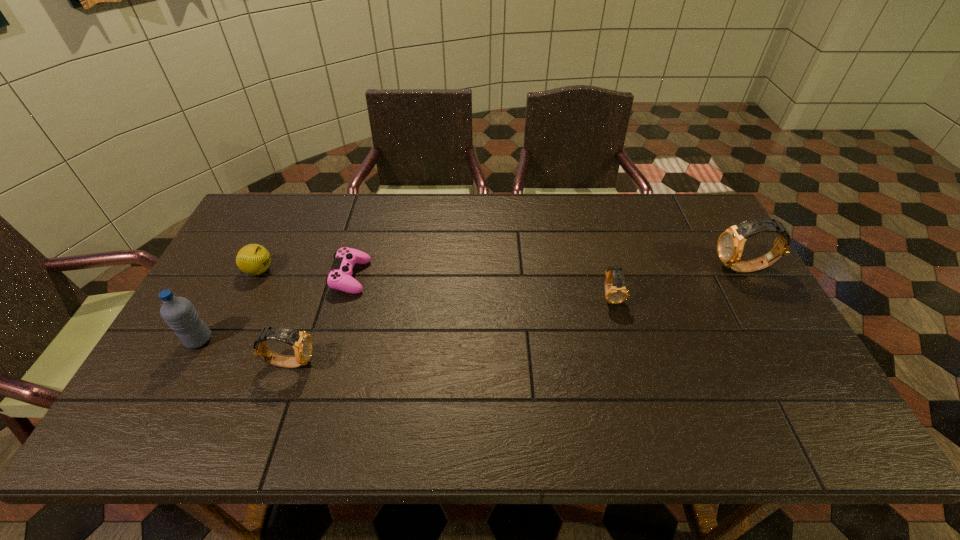
The width and height of the screenshot is (960, 540). Identify the location of object that is at the right edge. (730, 245).

Identify the location of free region at the far edge. (562, 200).

Where is `vacant space at the near edge of the desktop`? vacant space at the near edge of the desktop is located at coordinates (399, 381).

In the image, there is a desktop. Identify the location of vacant region at the left edge. (240, 297).

This screenshot has height=540, width=960. In the image, there is a desktop. Find the location of `vacant space at the right edge`. vacant space at the right edge is located at coordinates (709, 283).

Locate an element on the screen. The image size is (960, 540). free spot at the far left corner of the desktop is located at coordinates (270, 208).

In the image, there is a desktop. Identify the location of vacant space at the far right corner. (676, 210).

Identify the location of empty space between the nearest watch and the second object from right to left. (450, 329).

Identify the location of vacant area between the water bottle and the control. The width and height of the screenshot is (960, 540). (275, 308).

Identify the location of vacant space that is in between the nearest watch and the water bottle. This screenshot has width=960, height=540. (245, 351).